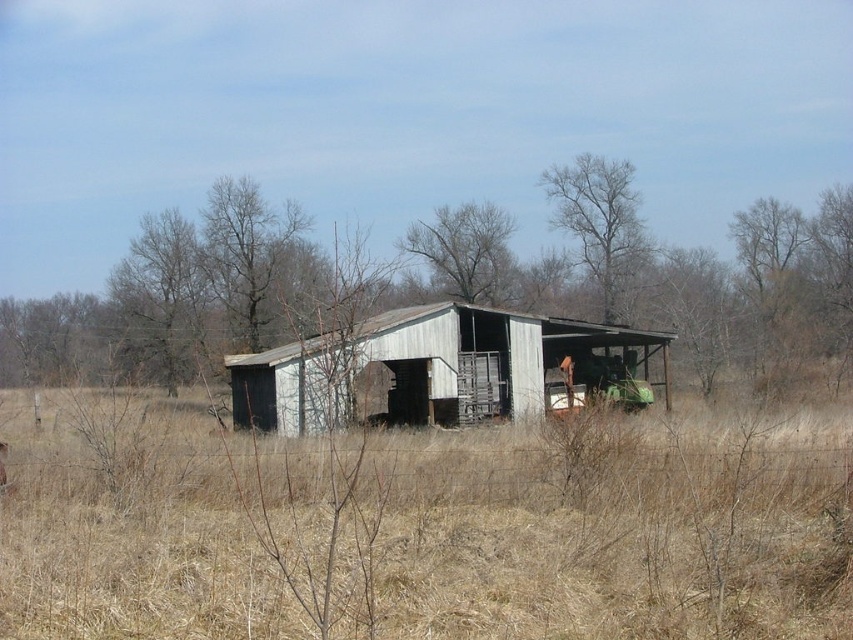
Question: Which point is farther to the camera?

Choices:
 (A) brown dry grass at center
 (B) white corrugated metal barn at center

Answer: (B)

Question: Which object is closer to the camera taking this photo?

Choices:
 (A) brown dry grass at center
 (B) white corrugated metal barn at center

Answer: (A)

Question: From the image, what is the correct spatial relationship of brown dry grass at center in relation to white corrugated metal barn at center?

Choices:
 (A) below
 (B) above

Answer: (A)

Question: Observing the image, what is the correct spatial positioning of brown dry grass at center in reference to white corrugated metal barn at center?

Choices:
 (A) left
 (B) right

Answer: (B)

Question: Does brown dry grass at center appear over white corrugated metal barn at center?

Choices:
 (A) yes
 (B) no

Answer: (B)